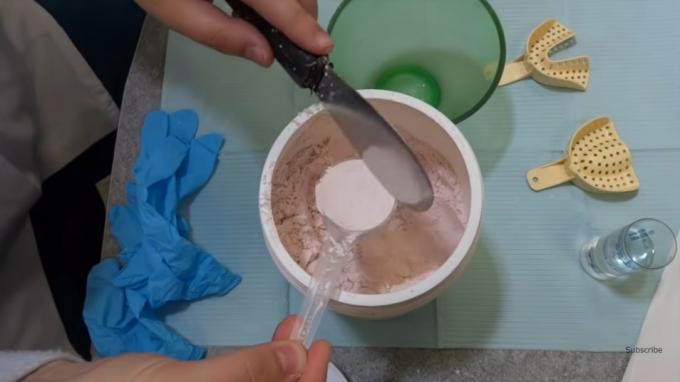
Find the location of a particular element. glass is located at coordinates (602, 266).